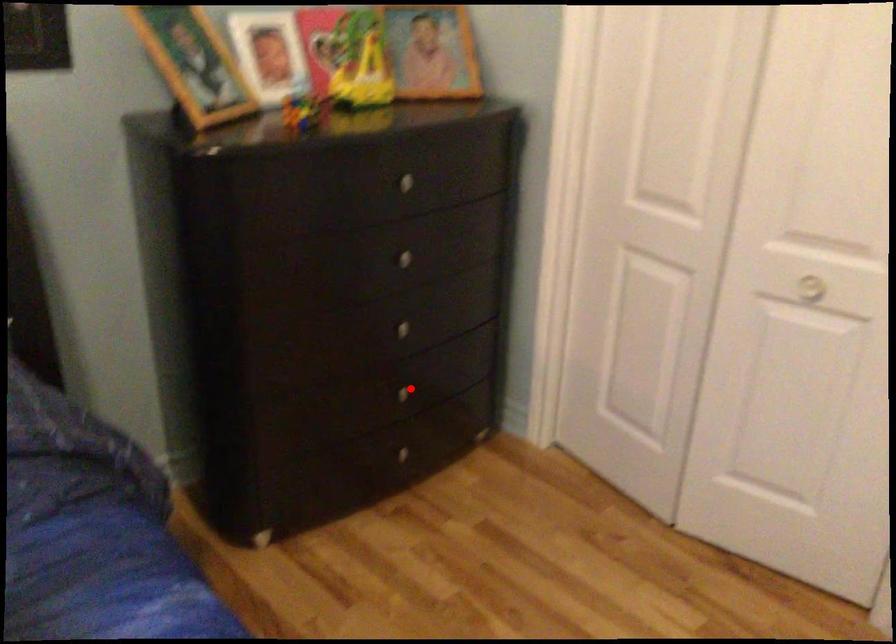
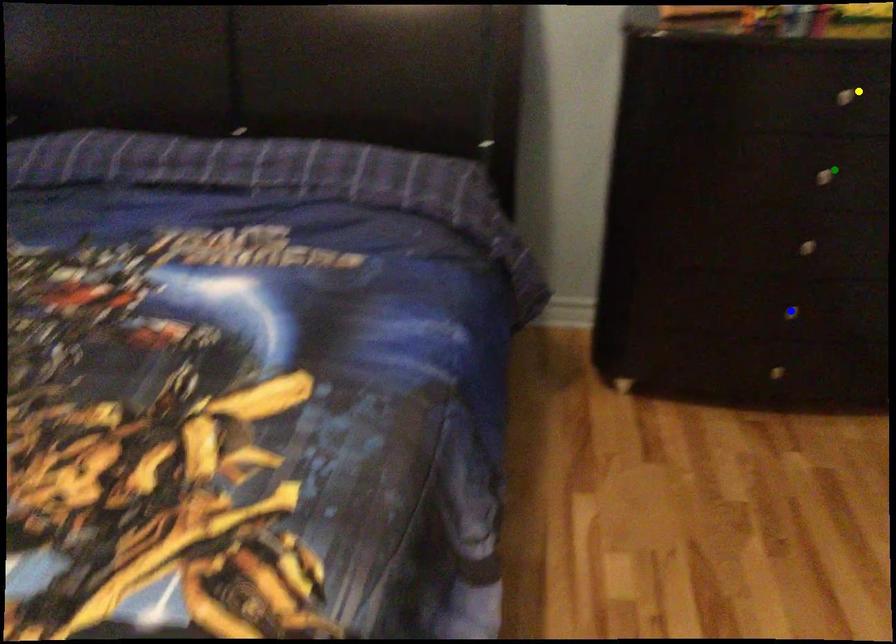
Question: I am providing you with two images of the same scene from different viewpoints. A red point is marked on the first image. You are given multiple points on the second image. Which mark in image 2 goes with the point in image 1?

Choices:
 (A) yellow point
 (B) green point
 (C) blue point

Answer: (C)